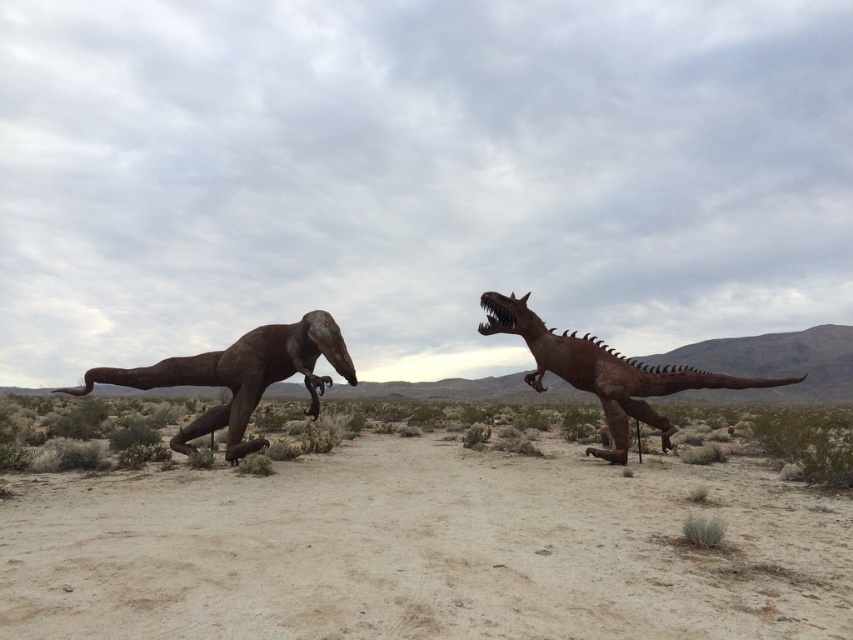
Is rusty metal dinosaur at left above rusty metal dinosaur at right?

No, rusty metal dinosaur at left is not above rusty metal dinosaur at right.

Is rusty metal dinosaur at left thinner than rusty metal dinosaur at right?

Incorrect, rusty metal dinosaur at left's width is not less than rusty metal dinosaur at right's.

Locate an element on the screen. The height and width of the screenshot is (640, 853). rusty metal dinosaur at left is located at coordinates pyautogui.click(x=241, y=376).

You are a GUI agent. You are given a task and a screenshot of the screen. Output one action in this format:
    pyautogui.click(x=<x>, y=<y>)
    Task: Click on the rusty metal dinosaur at left
    The height and width of the screenshot is (640, 853).
    Given the screenshot: What is the action you would take?
    pyautogui.click(x=241, y=376)

Does dirt field at center have a greater height compared to rusty metal dinosaur at left?

Yes.

Measure the distance between point (x=634, y=628) and camera.

Point (x=634, y=628) and camera are 2.79 meters apart.

Is point (801, 538) closer to camera compared to point (317, 406)?

Yes, point (801, 538) is in front of point (317, 406).

You are a GUI agent. You are given a task and a screenshot of the screen. Output one action in this format:
    pyautogui.click(x=<x>, y=<y>)
    Task: Click on the dirt field at center
    The image size is (853, 640).
    Given the screenshot: What is the action you would take?
    pyautogui.click(x=424, y=550)

Can you confirm if dirt field at center is shorter than rusty metal dinosaur at right?

No, dirt field at center is not shorter than rusty metal dinosaur at right.

In the scene shown: Does dirt field at center appear on the right side of rusty metal dinosaur at right?

In fact, dirt field at center is to the left of rusty metal dinosaur at right.

Locate an element on the screen. This screenshot has height=640, width=853. dirt field at center is located at coordinates (424, 550).

Identify the location of dirt field at center. This screenshot has width=853, height=640. (424, 550).